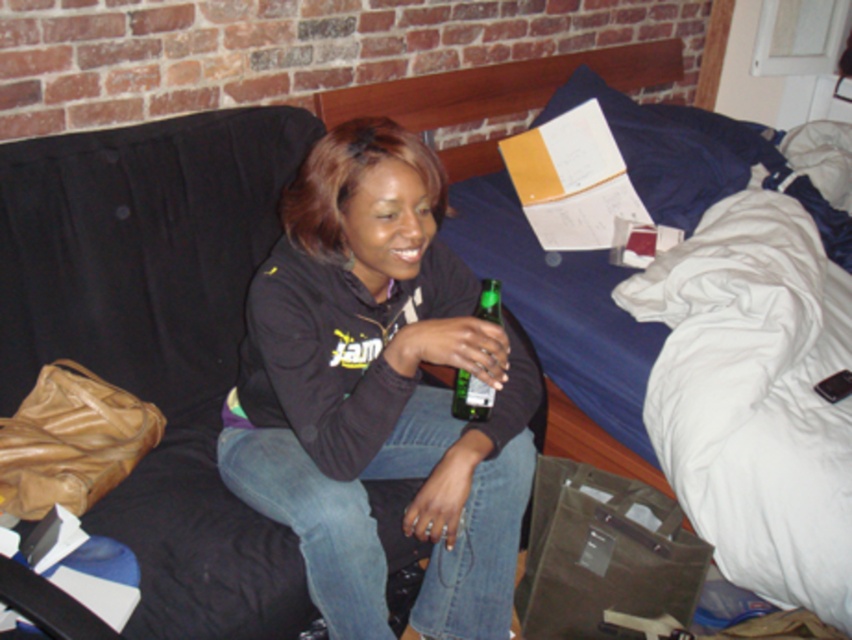
Does black matte sweatshirt at center have a lesser width compared to blue fabric bed at upper center?

Yes, black matte sweatshirt at center is thinner than blue fabric bed at upper center.

Identify the location of black matte sweatshirt at center. (378, 392).

Is blue fabric bed at upper center bigger than green glass bottle at center?

Yes.

Is point (591, 456) closer to viewer compared to point (475, 380)?

That is False.

Is point (446, 74) in front of point (455, 406)?

No, it is behind (455, 406).

At what (x,y) coordinates should I click in order to perform the action: click on blue fabric bed at upper center. Please return your answer as a coordinate pair (x, y). The image size is (852, 640). Looking at the image, I should click on (498, 86).

Between point (337, 476) and point (484, 300), which one is positioned behind?

Positioned behind is point (484, 300).

Is black matte sweatshirt at center bigger than green glass bottle at center?

Yes, black matte sweatshirt at center is bigger than green glass bottle at center.

Which is behind, point (243, 401) or point (493, 291)?

The point (243, 401) is more distant.

Locate an element on the screen. Image resolution: width=852 pixels, height=640 pixels. black matte sweatshirt at center is located at coordinates (378, 392).